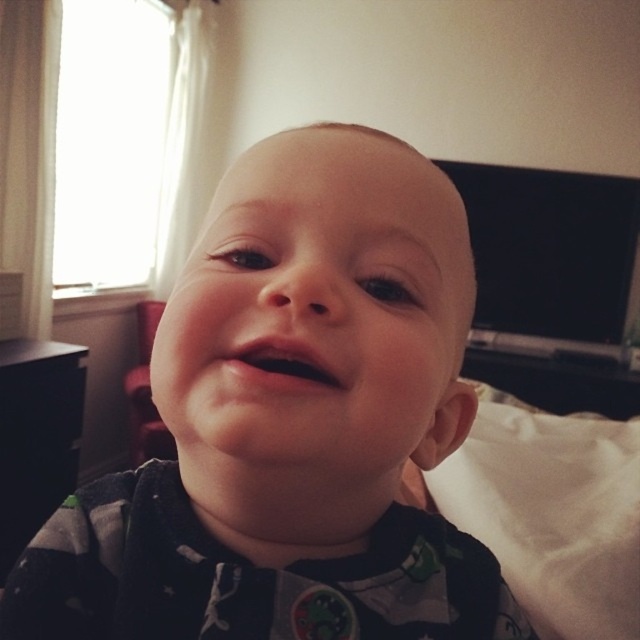
The baby is lying on a soft gray fabric at center and a white soft pillow at lower right. Which object is underneath the other?

The soft gray fabric at center is positioned over the white soft pillow at lower right, so the white soft pillow at lower right is underneath the soft gray fabric at center.

You are a photographer setting up a studio for a baby photoshoot. You have a soft gray fabric at center and a white soft pillow at lower right. The baby is placed in between them. Considering the height difference between the two items, which one should you adjust to ensure the baby can see you clearly while lying on their back?

The soft gray fabric at center is much taller than the white soft pillow at lower right. To ensure the baby can see clearly, lower the height of the soft gray fabric at center so it doesn not block the baby view.